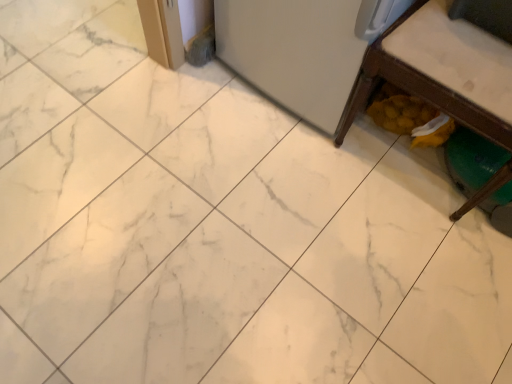
Question: Should I look upward or downward to see wooden bench at lower right?

Choices:
 (A) down
 (B) up

Answer: (B)